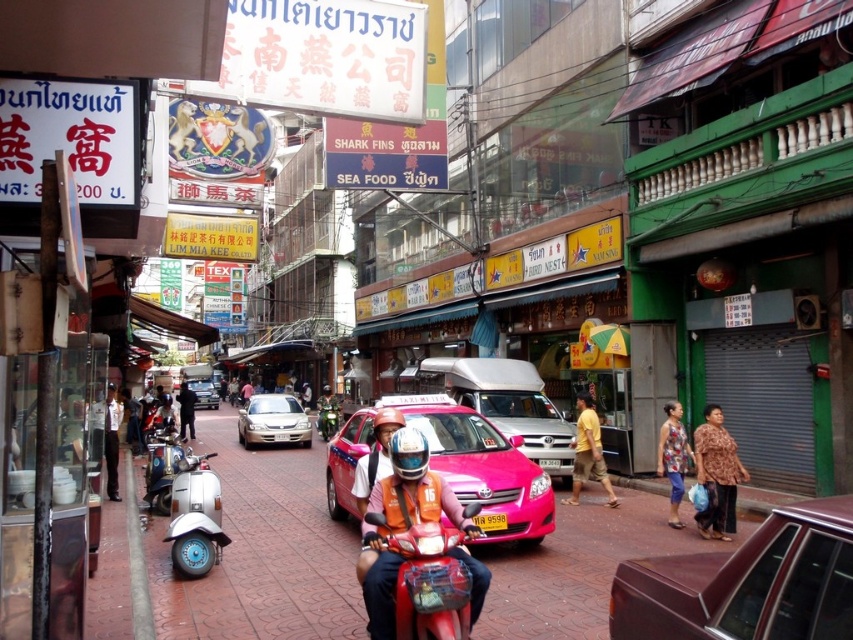
Question: Can you confirm if silver metallic scooter at center-left is bigger than black leather jacket at center?

Choices:
 (A) no
 (B) yes

Answer: (A)

Question: Among these objects, which one is nearest to the camera?

Choices:
 (A) yellow plastic license plate at center
 (B) black leather jacket at center
 (C) satin gold sedan at center
 (D) shiny red motorcycle at center

Answer: (D)

Question: Does maroon matte car at lower right appear over yellow plastic license plate at center?

Choices:
 (A) yes
 (B) no

Answer: (A)

Question: Which of these objects is positioned farthest from the white glossy scooter at left?

Choices:
 (A) black leather jacket at center
 (B) white helmet at center
 (C) floral-patterned dress at center
 (D) silver metallic scooter at center-left

Answer: (C)

Question: Which point appears farthest from the camera in this image?

Choices:
 (A) (212, 513)
 (B) (170, 440)

Answer: (B)

Question: Is pink matte taxi at center closer to the viewer compared to shiny red motorcycle at center?

Choices:
 (A) yes
 (B) no

Answer: (B)